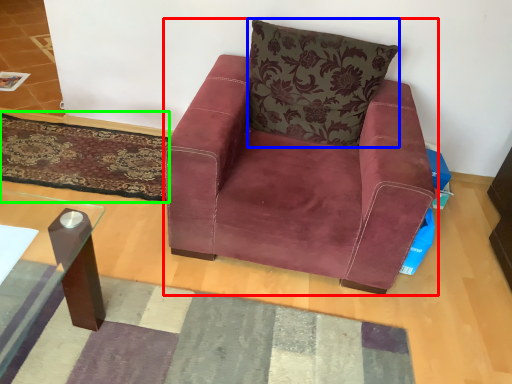
Question: Based on their relative distances, which object is nearer to chair (highlighted by a red box)? Choose from pillow (highlighted by a blue box) and mat (highlighted by a green box).

Choices:
 (A) pillow
 (B) mat

Answer: (A)